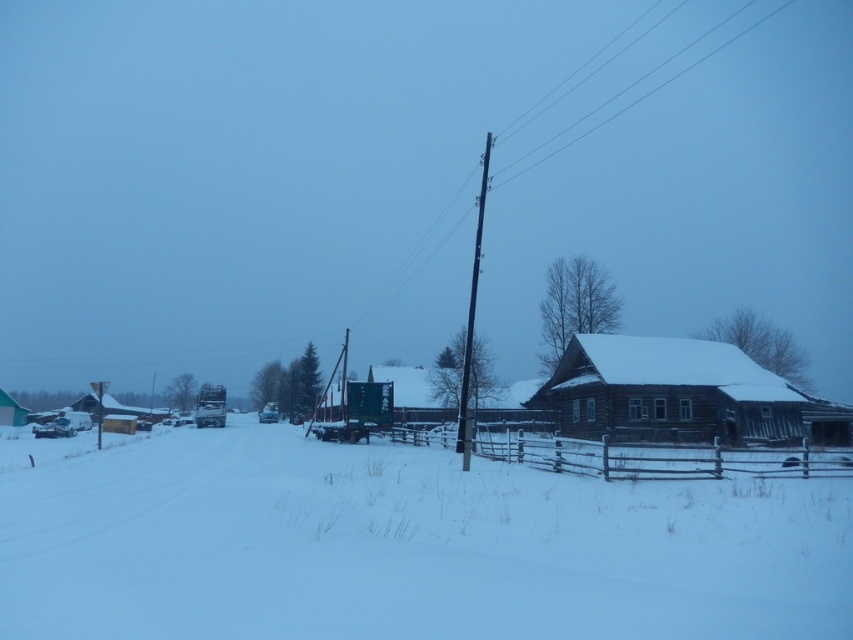
You are a snowplow operator trying to clear the road. You see the white powdery snow at center and the black wooden pole at center. Which object is wider? Please answer based on the scene description.

The white powdery snow at center is wider than the black wooden pole at center according to the description.

You are standing at the origin point of the coordinate system in this winter scene. The white powdery snow at center is located at a specific coordinate. Can you tell me where exactly it is located in terms of coordinates?

The white powdery snow at center is located at the coordinates point (401,545).